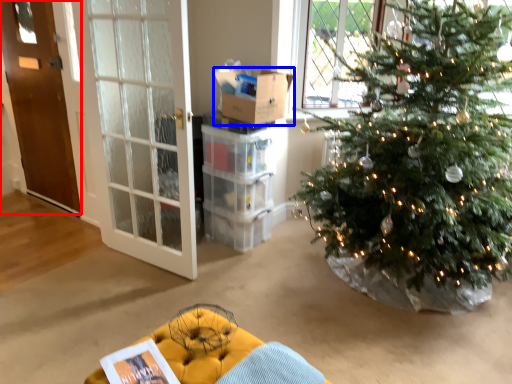
Question: Which object is further to the camera taking this photo, door (highlighted by a red box) or box (highlighted by a blue box)?

Choices:
 (A) door
 (B) box

Answer: (A)